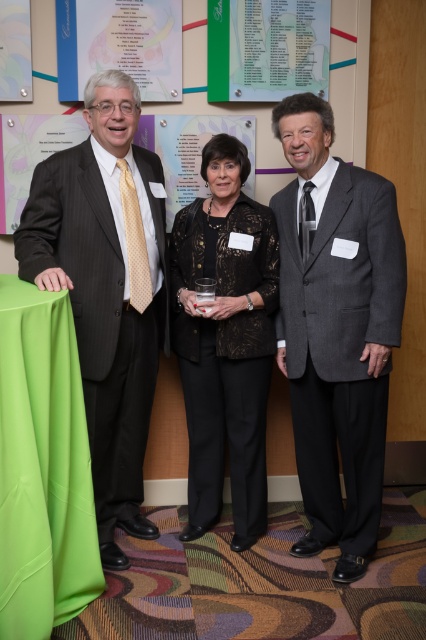
Can you confirm if gray textured suit at center is positioned below green satin tablecloth at lower left?

No.

Between gray textured suit at center and green satin tablecloth at lower left, which one has more height?

gray textured suit at center

Where is `gray textured suit at center`? The image size is (426, 640). gray textured suit at center is located at coordinates (336, 326).

Find the location of a particular element. This screenshot has height=640, width=426. gray textured suit at center is located at coordinates click(336, 326).

Which of these two, green satin tablecloth at lower left or green paperboard poster at upper center, stands shorter?

With less height is green paperboard poster at upper center.

This screenshot has height=640, width=426. What do you see at coordinates (43, 467) in the screenshot?
I see `green satin tablecloth at lower left` at bounding box center [43, 467].

Locate an element on the screen. The width and height of the screenshot is (426, 640). green satin tablecloth at lower left is located at coordinates (43, 467).

Is point (226, 280) closer to viewer compared to point (325, 97)?

That is True.

Who is positioned more to the right, black lace blouse at center or green paperboard poster at upper center?

Positioned to the right is green paperboard poster at upper center.

Which is in front, point (226, 243) or point (314, 17)?

Point (226, 243) is more forward.

This screenshot has width=426, height=640. Identify the location of black lace blouse at center. (224, 340).